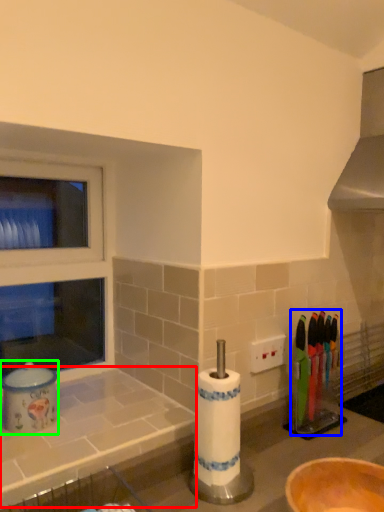
Question: Which is farther away from counter top (highlighted by a red box)? tableware (highlighted by a blue box) or appliance (highlighted by a green box)?

Choices:
 (A) tableware
 (B) appliance

Answer: (A)